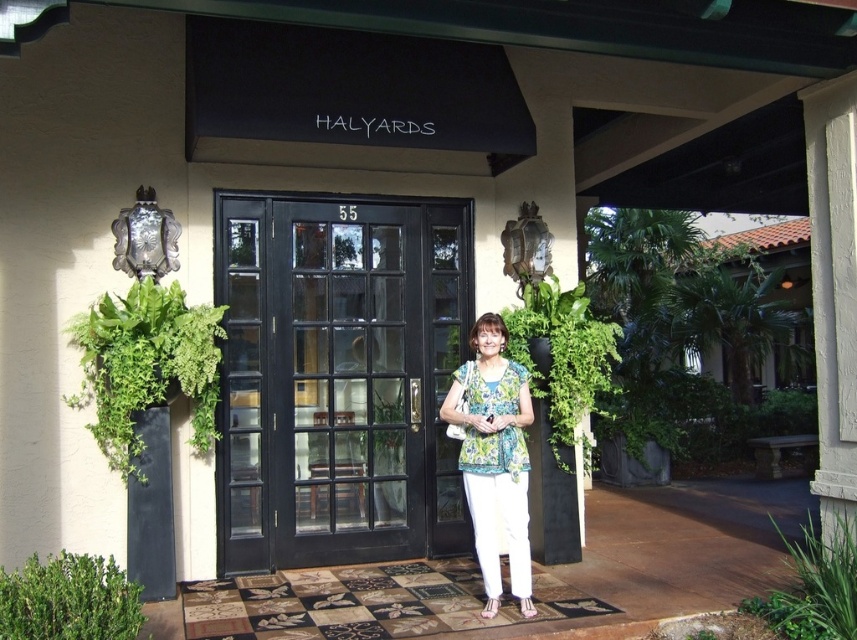
Question: Can you confirm if black glass door at center is bigger than floral blouse at center?

Choices:
 (A) yes
 (B) no

Answer: (A)

Question: Which object is the farthest from the green leafy bush at lower left?

Choices:
 (A) black glass door at center
 (B) green leafy plant at left

Answer: (A)

Question: Which of the following is the closest to the observer?

Choices:
 (A) floral blouse at center
 (B) green leafy bush at lower left

Answer: (B)

Question: Is black glass door at center behind green leafy plant at lower right?

Choices:
 (A) yes
 (B) no

Answer: (A)

Question: Does floral blouse at center lie behind green leafy plant at center?

Choices:
 (A) yes
 (B) no

Answer: (B)

Question: Which point is closer to the camera taking this photo?

Choices:
 (A) (502, 429)
 (B) (201, 387)
 (C) (106, 582)
 (D) (820, 620)

Answer: (C)